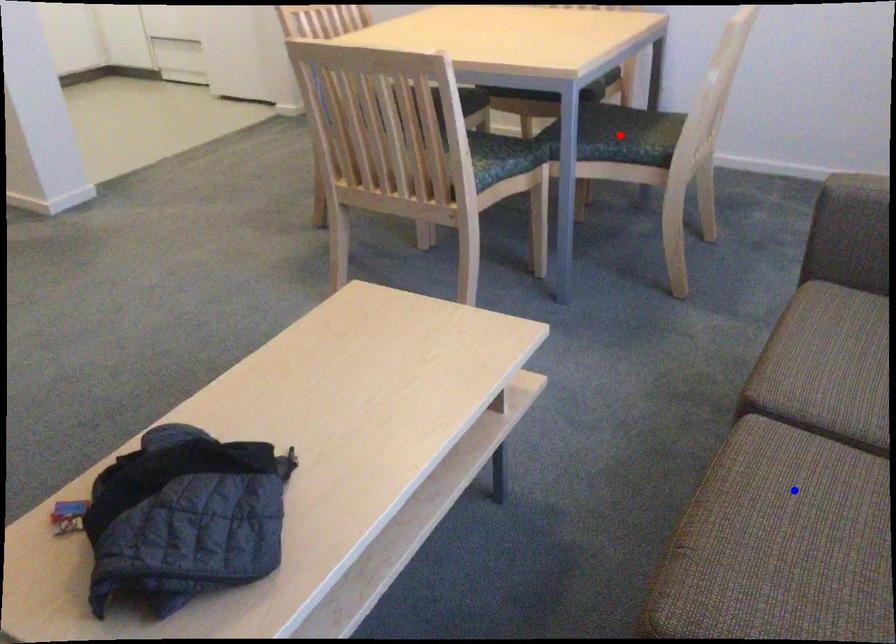
Question: In the image, two points are highlighted. Which point is nearer to the camera? Reply with the corresponding letter.

Choices:
 (A) blue point
 (B) red point

Answer: (A)